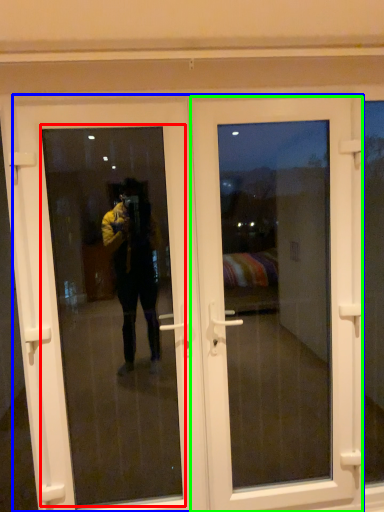
Question: Considering the real-world distances, which object is farthest from window screen (highlighted by a red box)? door (highlighted by a blue box) or door (highlighted by a green box)?

Choices:
 (A) door
 (B) door

Answer: (B)